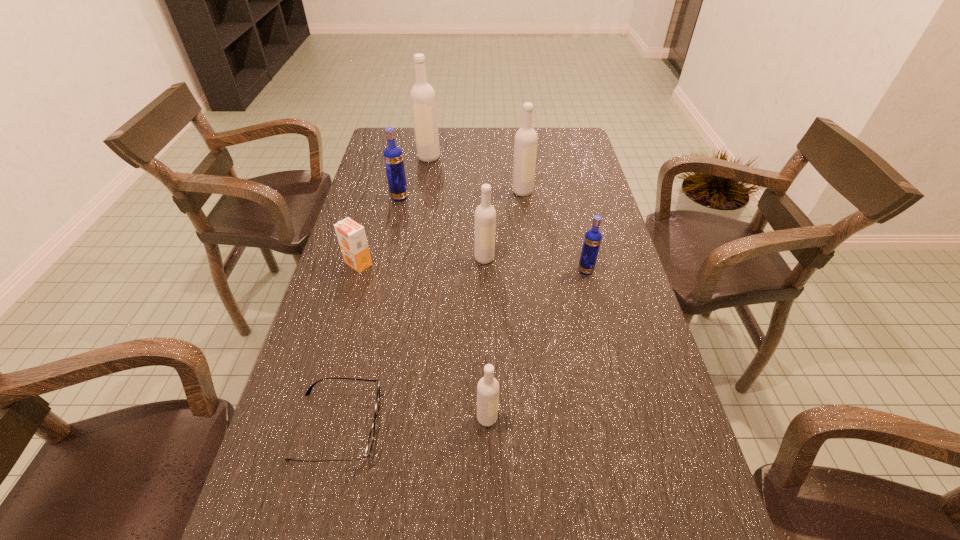
This screenshot has width=960, height=540. Identify the location of free spot between the orange juice and the rightmost object. (472, 267).

Locate an element on the screen. The width and height of the screenshot is (960, 540). vacant region between the second vodka from right to left and the spectacles is located at coordinates (430, 309).

The height and width of the screenshot is (540, 960). What are the coordinates of `object that is the seventh closest to the third nearest white vodka` in the screenshot? It's located at (372, 433).

Where is `object identified as the seventh closest to the smaller blue vodka`? Image resolution: width=960 pixels, height=540 pixels. object identified as the seventh closest to the smaller blue vodka is located at coordinates (423, 100).

Where is `vodka identified as the second closest to the rightmost vodka`? Image resolution: width=960 pixels, height=540 pixels. vodka identified as the second closest to the rightmost vodka is located at coordinates (525, 145).

Point out which vodka is positioned as the third nearest to the spectacles. Please provide its 2D coordinates. Your answer should be formatted as a tuple, i.e. [(x, y)], where the tuple contains the x and y coordinates of a point satisfying the conditions above.

[(592, 240)]

Identify which white vodka is the nearest to the nearest vodka. Please provide its 2D coordinates. Your answer should be formatted as a tuple, i.e. [(x, y)], where the tuple contains the x and y coordinates of a point satisfying the conditions above.

[(485, 214)]

At what (x,y) coordinates should I click in order to perform the action: click on the second closest white vodka to the left blue vodka. Please return your answer as a coordinate pair (x, y). Looking at the image, I should click on (485, 214).

At what (x,y) coordinates should I click in order to perform the action: click on free point that satisfies the following two spatial constraints: 1. on the front side of the nearest vodka; 2. on the front-facing side of the spectacles. Please return your answer as a coordinate pair (x, y). This screenshot has height=540, width=960. Looking at the image, I should click on (488, 426).